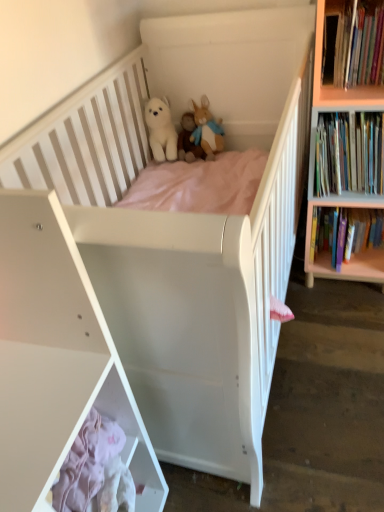
Question: Can you confirm if fluffy beige rabbit at upper center, the 1th toy from the right, is bigger than white matte shelf at lower left?

Choices:
 (A) yes
 (B) no

Answer: (B)

Question: Considering the relative sizes of fluffy beige rabbit at upper center, which is the 3th toy in left-to-right order, and white matte shelf at lower left in the image provided, is fluffy beige rabbit at upper center, which is the 3th toy in left-to-right order, taller than white matte shelf at lower left?

Choices:
 (A) no
 (B) yes

Answer: (A)

Question: Is fluffy beige rabbit at upper center, the 1th toy from the right, further to the viewer compared to white matte shelf at lower left?

Choices:
 (A) no
 (B) yes

Answer: (B)

Question: Could you tell me if fluffy beige rabbit at upper center, which is the 3th toy in left-to-right order, is facing white matte shelf at lower left?

Choices:
 (A) no
 (B) yes

Answer: (B)

Question: Does fluffy beige rabbit at upper center, which is the 3th toy in left-to-right order, have a lesser width compared to white matte shelf at lower left?

Choices:
 (A) yes
 (B) no

Answer: (A)

Question: Is fluffy beige rabbit at upper center, which is the 3th toy in left-to-right order, turned away from white matte shelf at lower left?

Choices:
 (A) no
 (B) yes

Answer: (A)

Question: Can you confirm if hardcover books at upper right, the 3th book ordered from the bottom, is shorter than hardcover books at right, which ranks as the 3th book in top-to-bottom order?

Choices:
 (A) no
 (B) yes

Answer: (B)

Question: Is hardcover books at upper right, arranged as the 1th book when viewed from the top, bigger than hardcover books at right, which ranks as the 3th book in top-to-bottom order?

Choices:
 (A) no
 (B) yes

Answer: (A)

Question: Is hardcover books at upper right, the 3th book ordered from the bottom, far away from hardcover books at right, arranged as the first book when ordered from the bottom?

Choices:
 (A) no
 (B) yes

Answer: (A)

Question: From a real-world perspective, is hardcover books at upper right, the 3th book ordered from the bottom, on hardcover books at right, which ranks as the 3th book in top-to-bottom order?

Choices:
 (A) yes
 (B) no

Answer: (A)

Question: Is hardcover books at upper right, arranged as the 1th book when viewed from the top, aimed at hardcover books at right, arranged as the first book when ordered from the bottom?

Choices:
 (A) yes
 (B) no

Answer: (B)

Question: Is hardcover books at upper right, the 3th book ordered from the bottom, in contact with hardcover books at right, which ranks as the 3th book in top-to-bottom order?

Choices:
 (A) yes
 (B) no

Answer: (B)

Question: From a real-world perspective, is fluffy beige rabbit at upper center, which is the 3th toy in left-to-right order, over hardcover books at upper right, arranged as the 1th book when viewed from the top?

Choices:
 (A) yes
 (B) no

Answer: (B)